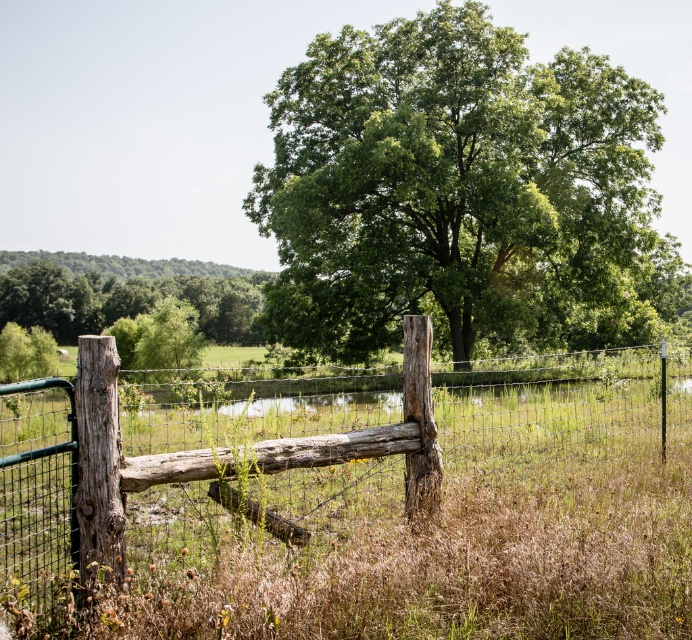
You are standing at the point marked as point (356,504) in the rural landscape scene. Which object from the scene are you currently standing on?

You are standing on the weathered wood fence at left.

You are a painter standing at the edge of the grassy field and want to paint the scene. You notice the weathered wood fence at left and the green leafy tree at upper center. Which object appears taller in the painting?

The green leafy tree at upper center appears taller than the weathered wood fence at left in the painting.